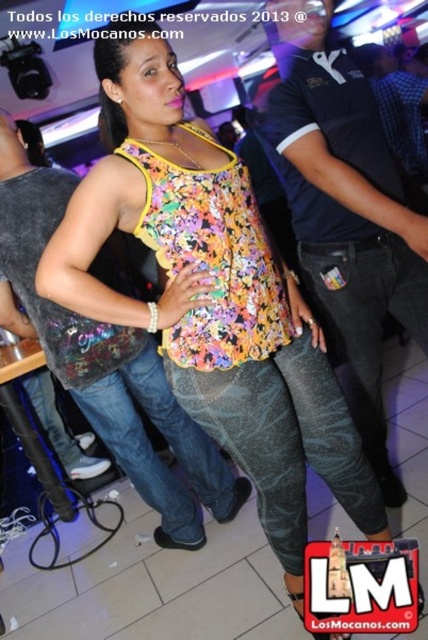
Question: Can you confirm if black cotton polo shirt at center is positioned above denim jeans at center?

Choices:
 (A) yes
 (B) no

Answer: (A)

Question: From the image, what is the correct spatial relationship of black cotton polo shirt at center in relation to denim jeans at center?

Choices:
 (A) left
 (B) right

Answer: (B)

Question: Which point is farther to the camera?

Choices:
 (A) (0, 164)
 (B) (291, 212)

Answer: (A)

Question: Can you confirm if black cotton polo shirt at center is positioned to the right of denim jeans at center?

Choices:
 (A) no
 (B) yes

Answer: (B)